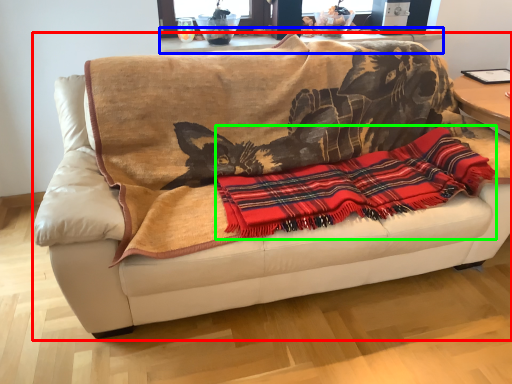
Question: Considering the real-world distances, which object is farthest from studio couch (highlighted by a red box)? table (highlighted by a blue box) or cloth (highlighted by a green box)?

Choices:
 (A) table
 (B) cloth

Answer: (A)